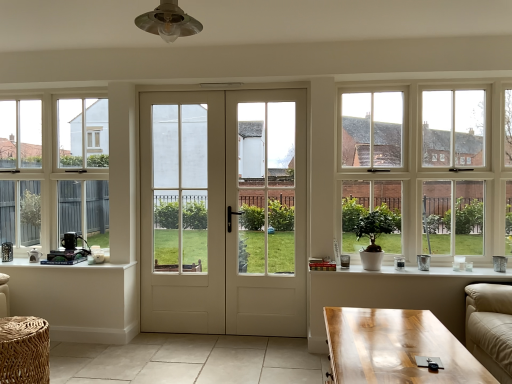
This screenshot has width=512, height=384. I want to click on vacant space situated on the left part of white glass door at center, which is the second screen door in right-to-left order, so click(142, 342).